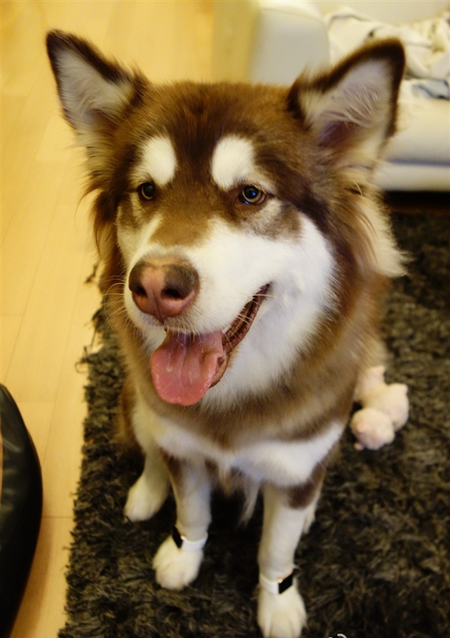
Where is `1 rug`? This screenshot has width=450, height=638. 1 rug is located at coordinates (375, 508).